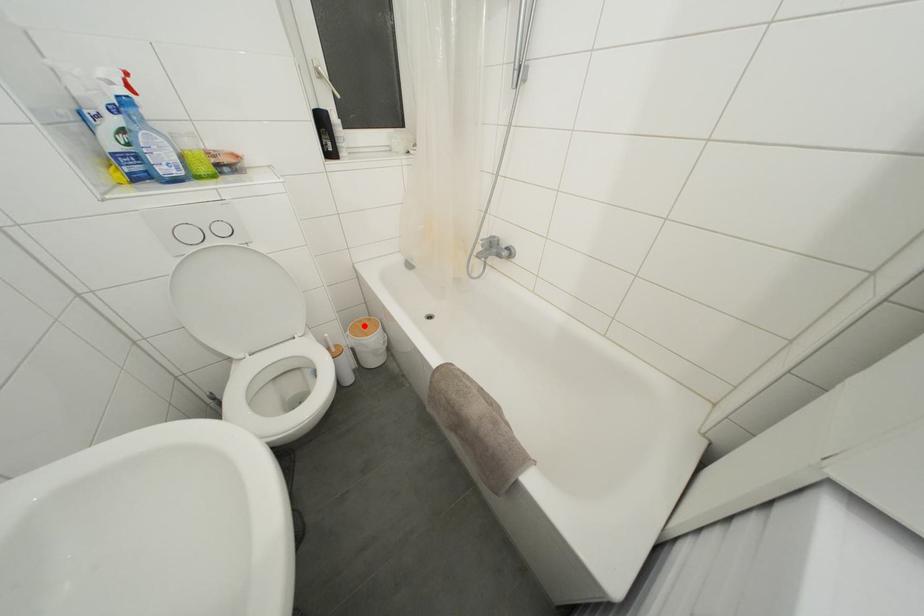
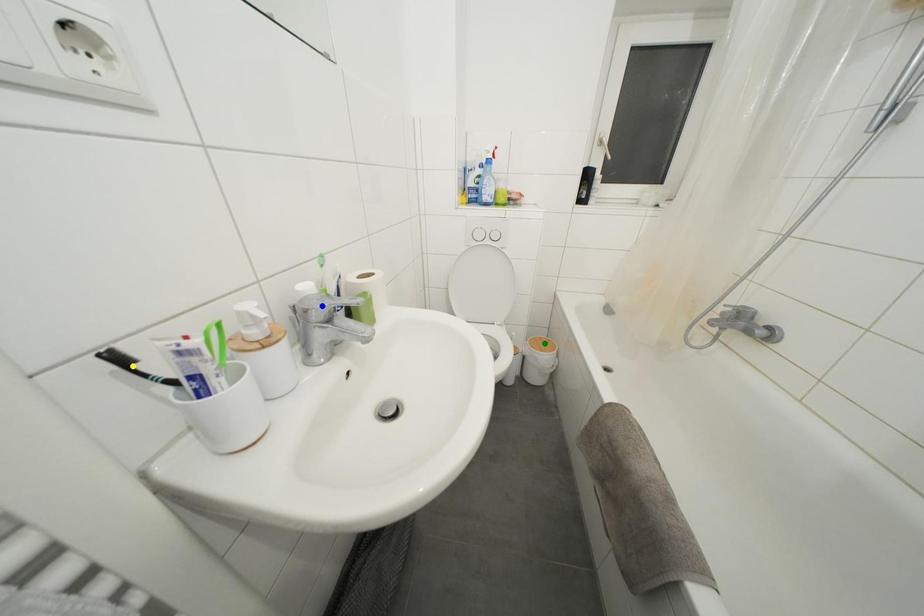
Question: I am providing you with two images of the same scene from different viewpoints. A red point is marked on the first image. You are given multiple points on the second image. Which point in image 2 represents the same 3d spot as the red point in image 1?

Choices:
 (A) yellow point
 (B) green point
 (C) blue point

Answer: (B)